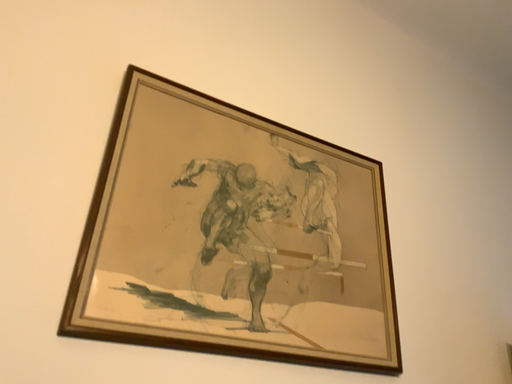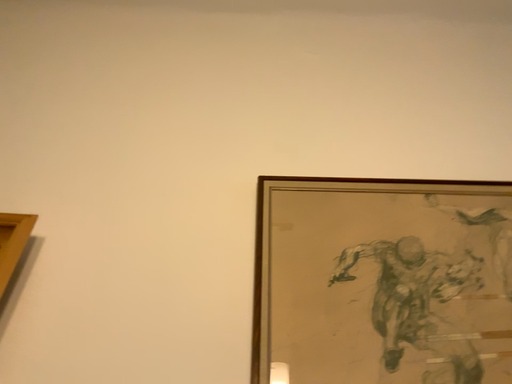
Question: Which way did the camera rotate in the video?

Choices:
 (A) rotated upward
 (B) rotated downward

Answer: (A)